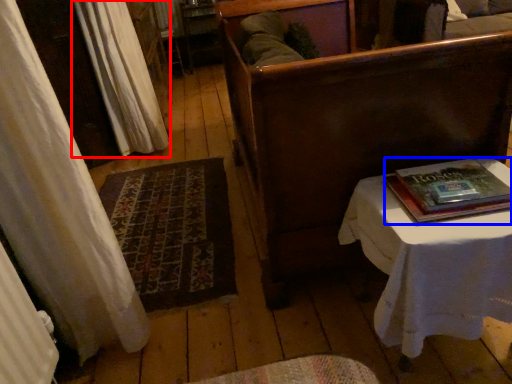
Question: Which of the following is the farthest to the observer, curtain (highlighted by a red box) or paperback book (highlighted by a blue box)?

Choices:
 (A) curtain
 (B) paperback book

Answer: (A)